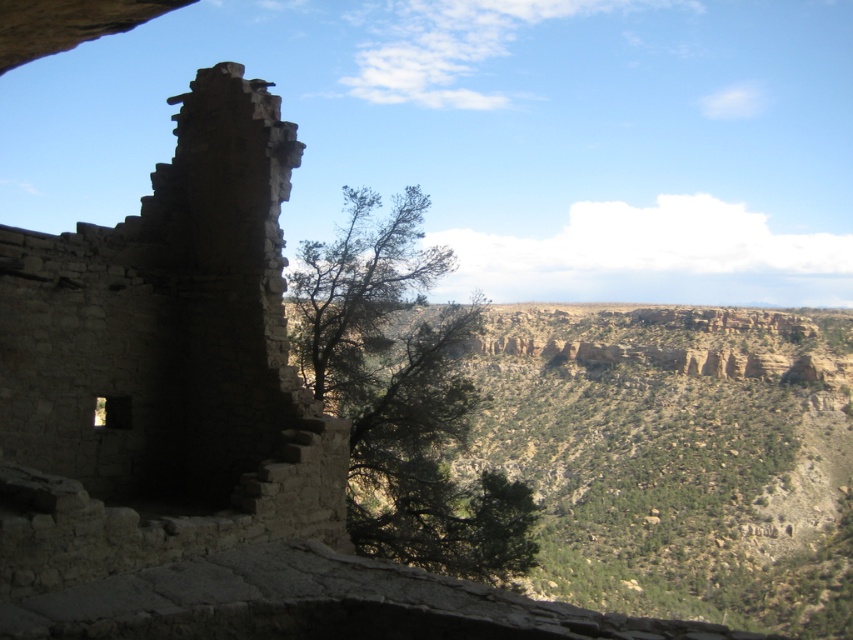
Question: Which of the following is the farthest from the observer?

Choices:
 (A) (276, 476)
 (B) (432, 568)

Answer: (B)

Question: Is rustic stone ruins at left to the right of green leafy tree at center from the viewer's perspective?

Choices:
 (A) yes
 (B) no

Answer: (B)

Question: Which object is farther from the camera taking this photo?

Choices:
 (A) rustic stone ruins at left
 (B) green leafy tree at center

Answer: (B)

Question: Can you confirm if rustic stone ruins at left is positioned below green leafy tree at center?

Choices:
 (A) no
 (B) yes

Answer: (B)

Question: Does rustic stone ruins at left appear on the left side of green leafy tree at center?

Choices:
 (A) yes
 (B) no

Answer: (A)